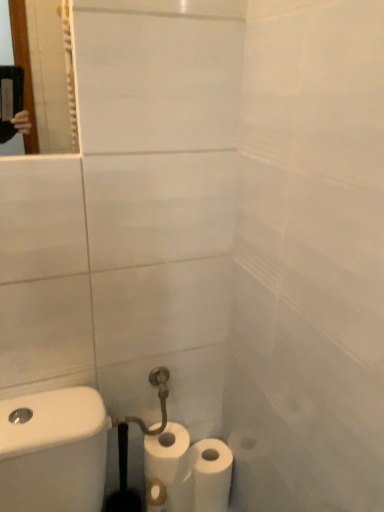
You are a GUI agent. You are given a task and a screenshot of the screen. Output one action in this format:
    pyautogui.click(x=<x>, y=<y>)
    Task: Click on the white matte toilet paper at lower center, the 1th toilet paper in the left-to-right sequence
    This screenshot has width=384, height=512.
    Given the screenshot: What is the action you would take?
    pyautogui.click(x=166, y=469)

The image size is (384, 512). Describe the element at coordinates (166, 469) in the screenshot. I see `white matte toilet paper at lower center, the 1th toilet paper in the left-to-right sequence` at that location.

What do you see at coordinates (211, 475) in the screenshot? I see `white matte toilet paper at lower center, the second toilet paper viewed from the left` at bounding box center [211, 475].

Measure the distance between point (221, 497) and camera.

The depth of point (221, 497) is 3.85 feet.

The width and height of the screenshot is (384, 512). In order to click on white matte toilet paper at lower center, arranged as the first toilet paper when viewed from the right in this screenshot , I will do 211,475.

In order to face white matte toilet paper at lower center, the second toilet paper viewed from the left, should I rotate leftwards or rightwards?

Rotate right and turn 2.264 degrees.

Identify the location of white matte toilet paper at lower center, the 1th toilet paper in the left-to-right sequence. The image size is (384, 512). tap(166, 469).

Is white matte toilet paper at lower center, the second toilet paper viewed from the right, at the left side of white matte toilet paper at lower center, arranged as the first toilet paper when viewed from the right?

Indeed, white matte toilet paper at lower center, the second toilet paper viewed from the right, is positioned on the left side of white matte toilet paper at lower center, arranged as the first toilet paper when viewed from the right.

Is white matte toilet paper at lower center, the 1th toilet paper in the left-to-right sequence, closer to camera compared to white matte toilet paper at lower center, arranged as the first toilet paper when viewed from the right?

Yes, white matte toilet paper at lower center, the 1th toilet paper in the left-to-right sequence, is closer to the viewer.

Is point (163, 504) closer or farther from the camera than point (222, 503)?

Point (163, 504) is closer to the camera than point (222, 503).

From the image's perspective, which is above, white matte toilet paper at lower center, the second toilet paper viewed from the right, or white matte toilet paper at lower center, the second toilet paper viewed from the left?

From the image's view, white matte toilet paper at lower center, the second toilet paper viewed from the right, is above.

From a real-world perspective, is white matte toilet paper at lower center, the 1th toilet paper in the left-to-right sequence, positioned above or below white matte toilet paper at lower center, arranged as the first toilet paper when viewed from the right?

From a real-world perspective, white matte toilet paper at lower center, the 1th toilet paper in the left-to-right sequence, is physically above white matte toilet paper at lower center, arranged as the first toilet paper when viewed from the right.

Which of these two, white matte toilet paper at lower center, the 1th toilet paper in the left-to-right sequence, or white matte toilet paper at lower center, the second toilet paper viewed from the left, is thinner?

With smaller width is white matte toilet paper at lower center, the 1th toilet paper in the left-to-right sequence.

Does white matte toilet paper at lower center, the second toilet paper viewed from the right, have a greater height compared to white matte toilet paper at lower center, arranged as the first toilet paper when viewed from the right?

Yes, white matte toilet paper at lower center, the second toilet paper viewed from the right, is taller than white matte toilet paper at lower center, arranged as the first toilet paper when viewed from the right.

Considering the sizes of white matte toilet paper at lower center, the 1th toilet paper in the left-to-right sequence, and white matte toilet paper at lower center, the second toilet paper viewed from the left, in the image, is white matte toilet paper at lower center, the 1th toilet paper in the left-to-right sequence, bigger or smaller than white matte toilet paper at lower center, the second toilet paper viewed from the left,?

white matte toilet paper at lower center, the 1th toilet paper in the left-to-right sequence, is bigger than white matte toilet paper at lower center, the second toilet paper viewed from the left.

Would you say white matte toilet paper at lower center, the second toilet paper viewed from the right, is outside white matte toilet paper at lower center, arranged as the first toilet paper when viewed from the right?

That's correct, white matte toilet paper at lower center, the second toilet paper viewed from the right, is outside of white matte toilet paper at lower center, arranged as the first toilet paper when viewed from the right.

In the scene shown: Can you see white matte toilet paper at lower center, the second toilet paper viewed from the right, touching white matte toilet paper at lower center, arranged as the first toilet paper when viewed from the right?

Yes, white matte toilet paper at lower center, the second toilet paper viewed from the right, is touching white matte toilet paper at lower center, arranged as the first toilet paper when viewed from the right.

Could you tell me if white matte toilet paper at lower center, the second toilet paper viewed from the right, is facing white matte toilet paper at lower center, the second toilet paper viewed from the left?

No, white matte toilet paper at lower center, the second toilet paper viewed from the right, is not turned towards white matte toilet paper at lower center, the second toilet paper viewed from the left.

What's the angular difference between white matte toilet paper at lower center, the 1th toilet paper in the left-to-right sequence, and white matte toilet paper at lower center, arranged as the first toilet paper when viewed from the right,'s facing directions?

The facing directions of white matte toilet paper at lower center, the 1th toilet paper in the left-to-right sequence, and white matte toilet paper at lower center, arranged as the first toilet paper when viewed from the right, are 0.868 degrees apart.

In the image, there is a white matte toilet paper at lower center, the second toilet paper viewed from the right. Identify the location of toilet paper below it (from the image's perspective). (211, 475).

Does white matte toilet paper at lower center, the second toilet paper viewed from the left, appear on the right side of white matte toilet paper at lower center, the second toilet paper viewed from the right?

Indeed, white matte toilet paper at lower center, the second toilet paper viewed from the left, is positioned on the right side of white matte toilet paper at lower center, the second toilet paper viewed from the right.

In the scene shown: Is white matte toilet paper at lower center, the second toilet paper viewed from the left, in front of or behind white matte toilet paper at lower center, the 1th toilet paper in the left-to-right sequence, in the image?

white matte toilet paper at lower center, the second toilet paper viewed from the left, is behind white matte toilet paper at lower center, the 1th toilet paper in the left-to-right sequence.

Which point is more distant from viewer, [213,482] or [148,503]?

The point [213,482] is behind.

From the image's perspective, is white matte toilet paper at lower center, the second toilet paper viewed from the left, below white matte toilet paper at lower center, the 1th toilet paper in the left-to-right sequence?

Yes, from the image's perspective, white matte toilet paper at lower center, the second toilet paper viewed from the left, is below white matte toilet paper at lower center, the 1th toilet paper in the left-to-right sequence.

From a real-world perspective, between white matte toilet paper at lower center, arranged as the first toilet paper when viewed from the right, and white matte toilet paper at lower center, the 1th toilet paper in the left-to-right sequence, who is vertically higher?

white matte toilet paper at lower center, the 1th toilet paper in the left-to-right sequence, is physically above.

Is white matte toilet paper at lower center, arranged as the first toilet paper when viewed from the right, thinner than white matte toilet paper at lower center, the 1th toilet paper in the left-to-right sequence?

Incorrect, the width of white matte toilet paper at lower center, arranged as the first toilet paper when viewed from the right, is not less than that of white matte toilet paper at lower center, the 1th toilet paper in the left-to-right sequence.

From the picture: In terms of height, does white matte toilet paper at lower center, arranged as the first toilet paper when viewed from the right, look taller or shorter compared to white matte toilet paper at lower center, the second toilet paper viewed from the right?

Considering their sizes, white matte toilet paper at lower center, arranged as the first toilet paper when viewed from the right, has less height than white matte toilet paper at lower center, the second toilet paper viewed from the right.

Is white matte toilet paper at lower center, arranged as the first toilet paper when viewed from the right, bigger than white matte toilet paper at lower center, the 1th toilet paper in the left-to-right sequence?

Actually, white matte toilet paper at lower center, arranged as the first toilet paper when viewed from the right, might be smaller than white matte toilet paper at lower center, the 1th toilet paper in the left-to-right sequence.

Is white matte toilet paper at lower center, the 1th toilet paper in the left-to-right sequence, completely or partially inside white matte toilet paper at lower center, arranged as the first toilet paper when viewed from the right?

No.

Does white matte toilet paper at lower center, the second toilet paper viewed from the left, touch white matte toilet paper at lower center, the second toilet paper viewed from the right?

Yes, white matte toilet paper at lower center, the second toilet paper viewed from the left, and white matte toilet paper at lower center, the second toilet paper viewed from the right, clearly make contact.

Could you tell me if white matte toilet paper at lower center, arranged as the first toilet paper when viewed from the right, is facing white matte toilet paper at lower center, the 1th toilet paper in the left-to-right sequence?

No, white matte toilet paper at lower center, arranged as the first toilet paper when viewed from the right, is not turned towards white matte toilet paper at lower center, the 1th toilet paper in the left-to-right sequence.

How many degrees apart are the facing directions of white matte toilet paper at lower center, arranged as the first toilet paper when viewed from the right, and white matte toilet paper at lower center, the second toilet paper viewed from the right?

There is a 0.868-degree angle between the facing directions of white matte toilet paper at lower center, arranged as the first toilet paper when viewed from the right, and white matte toilet paper at lower center, the second toilet paper viewed from the right.

Locate an element on the screen. Image resolution: width=384 pixels, height=512 pixels. toilet paper on the left of the white matte toilet paper at lower center, the second toilet paper viewed from the left is located at coordinates (166, 469).

The height and width of the screenshot is (512, 384). Identify the location of toilet paper above the white matte toilet paper at lower center, the second toilet paper viewed from the left (from the image's perspective). (166, 469).

Where is `toilet paper that appears behind the white matte toilet paper at lower center, the 1th toilet paper in the left-to-right sequence`? toilet paper that appears behind the white matte toilet paper at lower center, the 1th toilet paper in the left-to-right sequence is located at coordinates (211, 475).